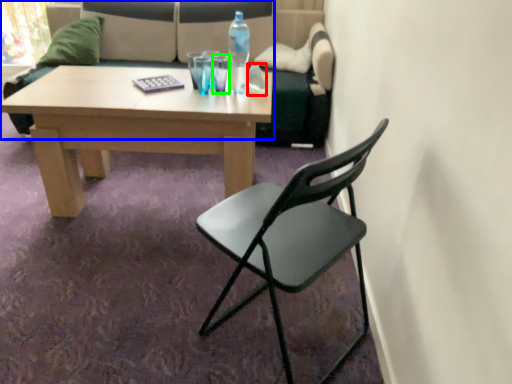
Question: Which is farther away from towel/napkin (highlighted by a red box)? studio couch (highlighted by a blue box) or coffee cup (highlighted by a green box)?

Choices:
 (A) studio couch
 (B) coffee cup

Answer: (A)